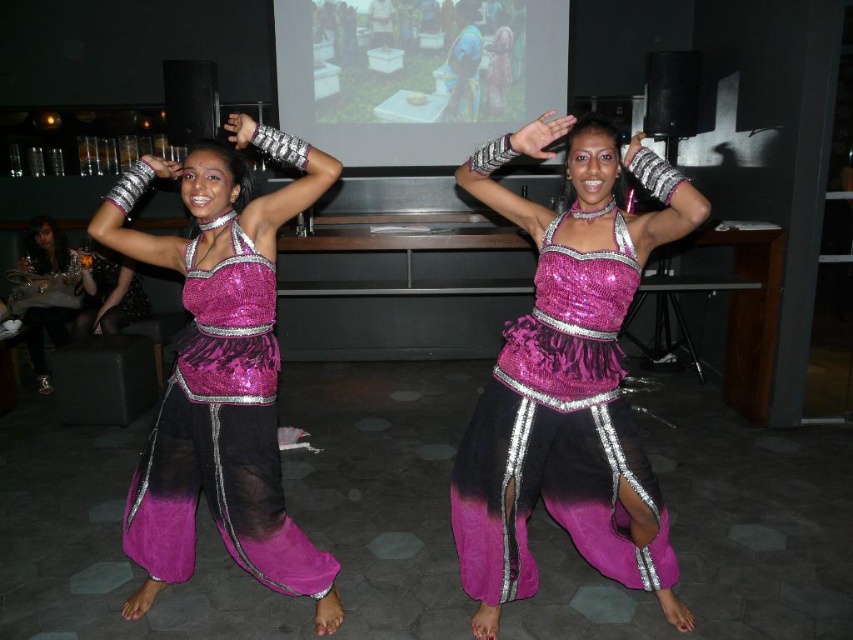
Question: Does shiny sequined dress at center have a larger size compared to matte black dress at lower left?

Choices:
 (A) yes
 (B) no

Answer: (A)

Question: Is shiny sequined dress at center below fuchsia sequined dress at center?

Choices:
 (A) yes
 (B) no

Answer: (B)

Question: Which object is the closest to the shiny sequined dress at center?

Choices:
 (A) fuchsia sequined dress at center
 (B) matte black dress at lower left

Answer: (A)

Question: Among these points, which one is nearest to the camera?

Choices:
 (A) (210, 352)
 (B) (38, 323)

Answer: (A)

Question: Observing the image, what is the correct spatial positioning of shiny sequined dress at center in reference to matte black dress at lower left?

Choices:
 (A) above
 (B) below

Answer: (B)

Question: Which object is positioned farthest from the fuchsia sequined dress at center?

Choices:
 (A) matte black dress at lower left
 (B) shiny sequined dress at center

Answer: (A)